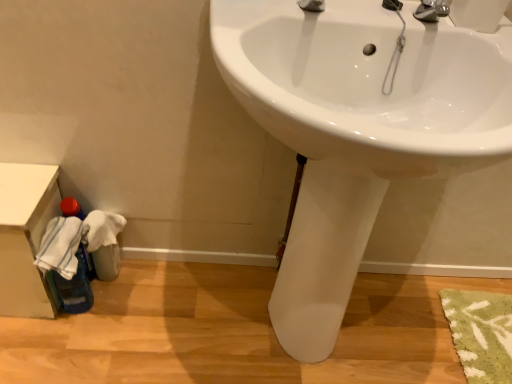
The width and height of the screenshot is (512, 384). What are the coordinates of `vacant space situated above white plastic bin at lower left (from a real-world perspective)` in the screenshot? It's located at (14, 178).